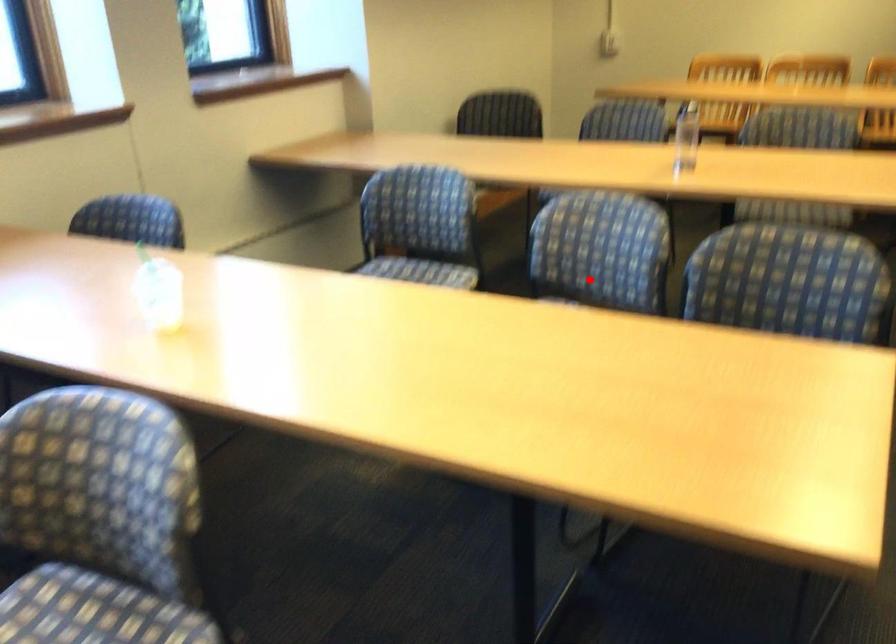
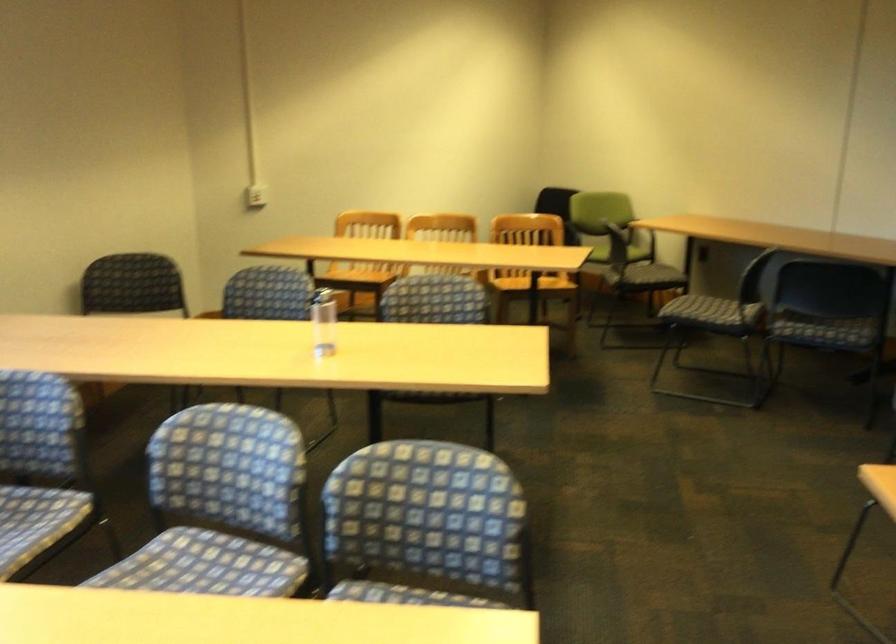
Where in the second image is the point corresponding to the highlighted location from the first image?

(221, 506)